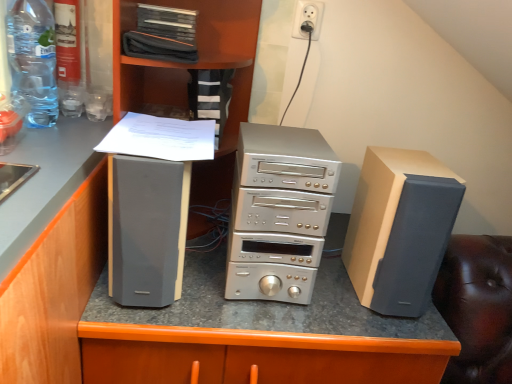
The image size is (512, 384). Identify the location of free point above white paper at center (from a real-world perspective). (163, 134).